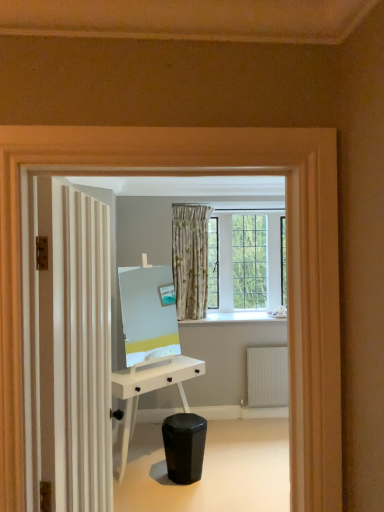
At what (x,y) coordinates should I click in order to perform the action: click on vacant space in front of white ribbed radiator at lower right. Please return your answer as a coordinate pair (x, y). The image size is (384, 512). Looking at the image, I should click on (269, 425).